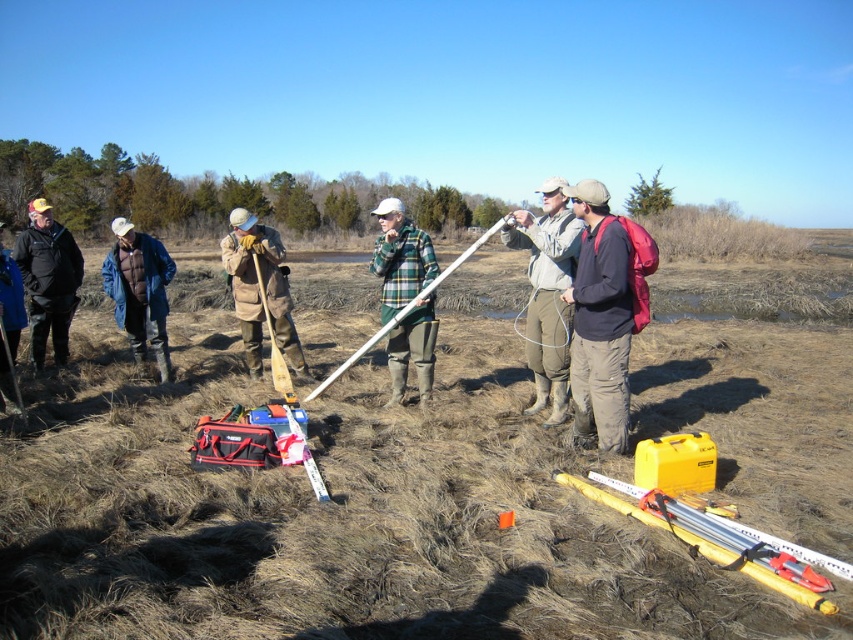
Question: Which object is positioned closest to the blue denim jacket at left?

Choices:
 (A) flannel shirt at center
 (B) green plaid shirt at center
 (C) brown fuzzy coat at center
 (D) yellow plastic ruler at lower right

Answer: (C)

Question: Can you confirm if flannel shirt at center is positioned to the left of brown fuzzy coat at center?

Choices:
 (A) no
 (B) yes

Answer: (A)

Question: Is brown grass at center bigger than matte black tool bag at center?

Choices:
 (A) yes
 (B) no

Answer: (A)

Question: Does brown fuzzy coat at center appear on the right side of yellow plastic ruler at lower right?

Choices:
 (A) yes
 (B) no

Answer: (B)

Question: Which point is farther from the camera taking this photo?

Choices:
 (A) (595, 220)
 (B) (819, 595)
 (C) (287, 296)

Answer: (C)

Question: Among these points, which one is farthest from the camera?

Choices:
 (A) (28, 292)
 (B) (323, 499)

Answer: (A)